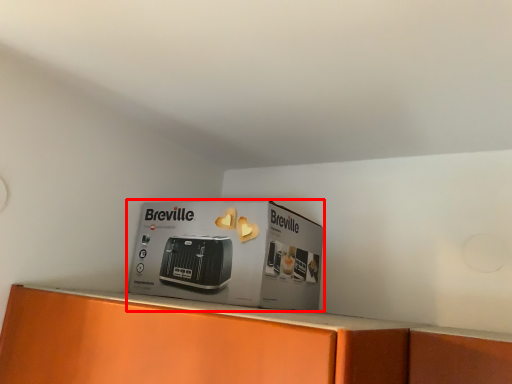
Question: Observing the image, what is the correct spatial positioning of cardboard box (annotated by the red box) in reference to home appliance?

Choices:
 (A) right
 (B) left

Answer: (B)